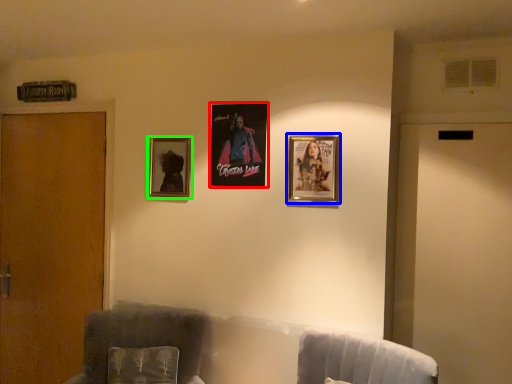
Question: Based on their relative distances, which object is farther from picture frame (highlighted by a red box)? Choose from picture frame (highlighted by a blue box) and picture frame (highlighted by a green box).

Choices:
 (A) picture frame
 (B) picture frame

Answer: (A)